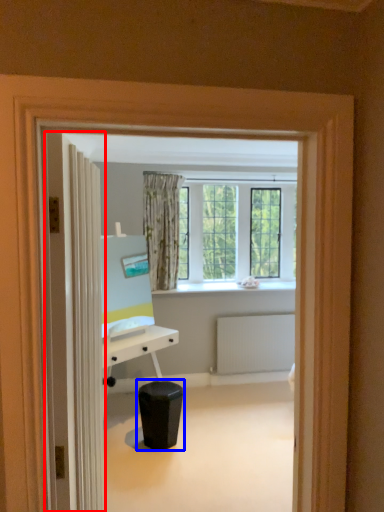
Question: Among these objects, which one is nearest to the camera, door (highlighted by a red box) or music stool (highlighted by a blue box)?

Choices:
 (A) door
 (B) music stool

Answer: (A)